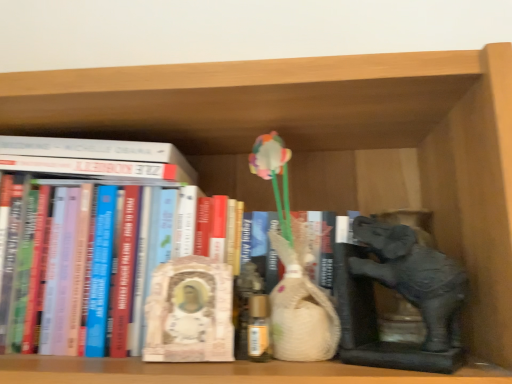
Where is `blank space situated above hardcover book at center, the first book from the bottom (from a real-world perspective)`? blank space situated above hardcover book at center, the first book from the bottom (from a real-world perspective) is located at coordinates (169, 121).